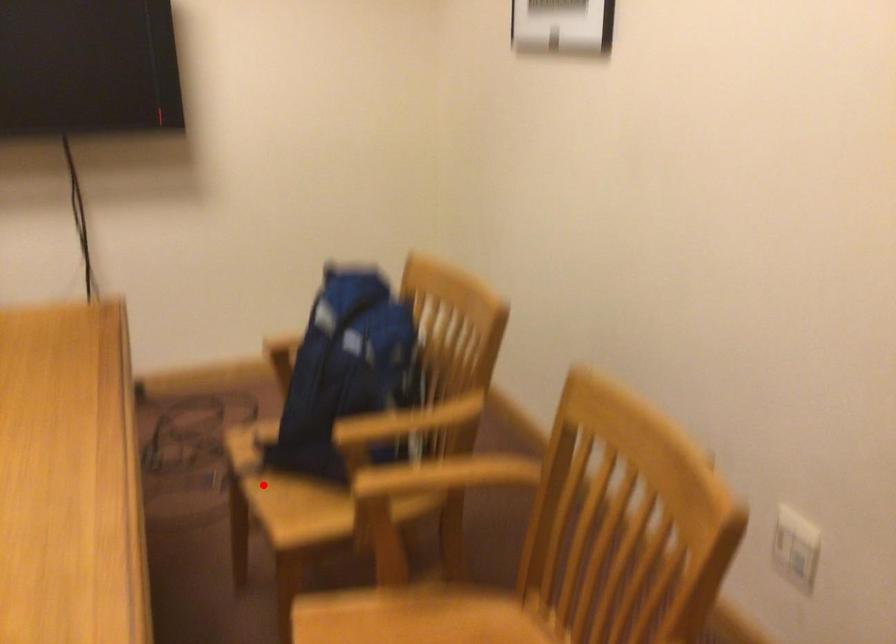
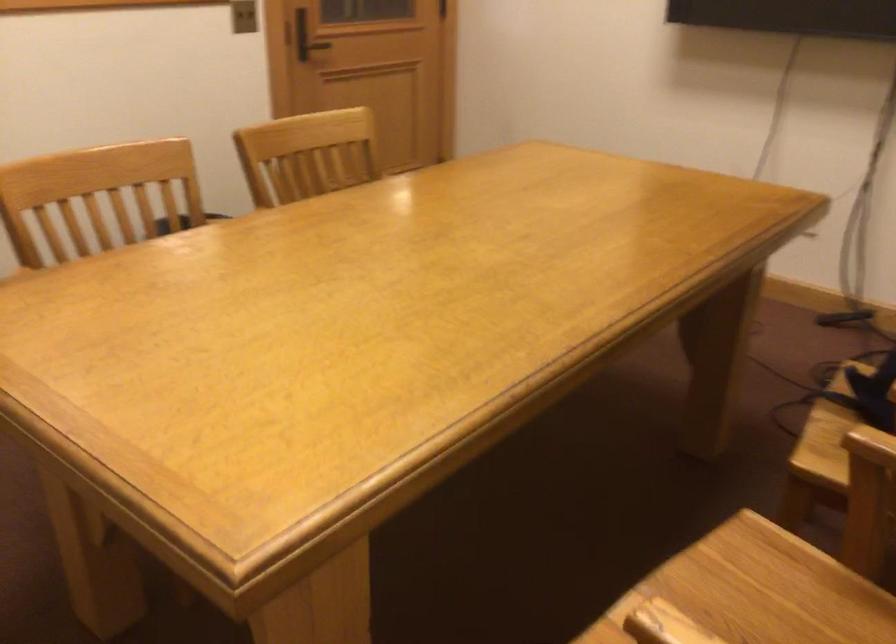
Locate, in the second image, the point that corresponds to the highlighted location in the first image.

(823, 419)